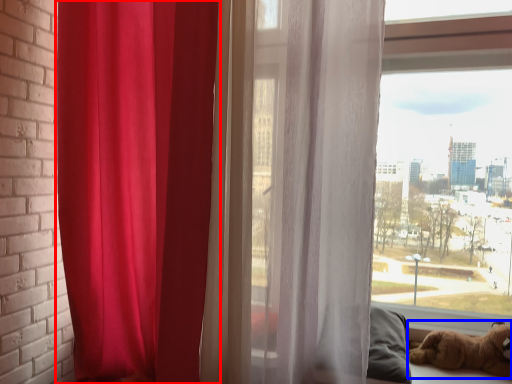
Question: Which point is further to the camera, curtain (highlighted by a red box) or dog (highlighted by a blue box)?

Choices:
 (A) curtain
 (B) dog

Answer: (B)